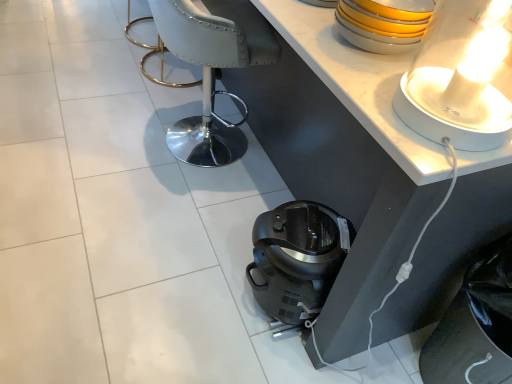
Where is `vacant area that lies between satin black coffee maker at lower center and white leather armchair at center`? vacant area that lies between satin black coffee maker at lower center and white leather armchair at center is located at coordinates (225, 203).